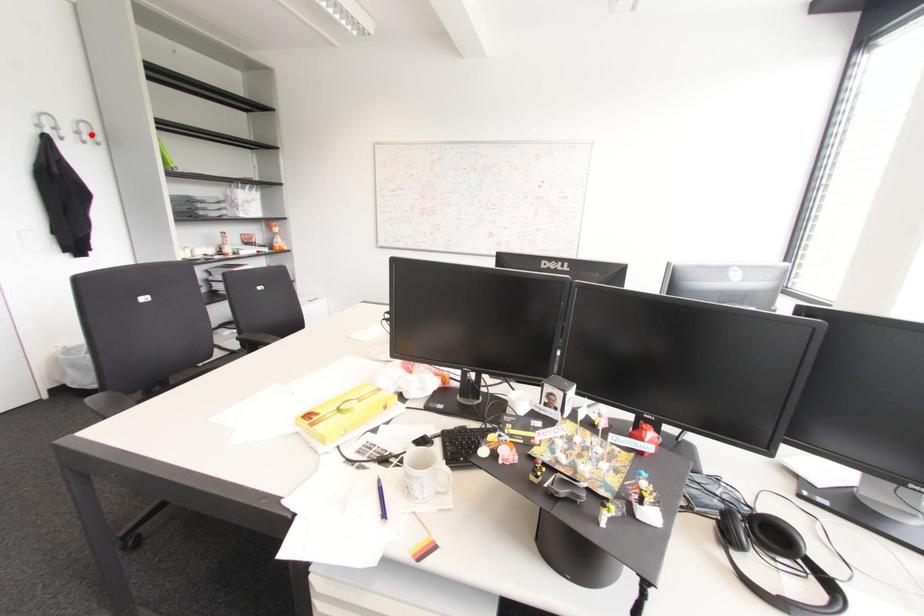
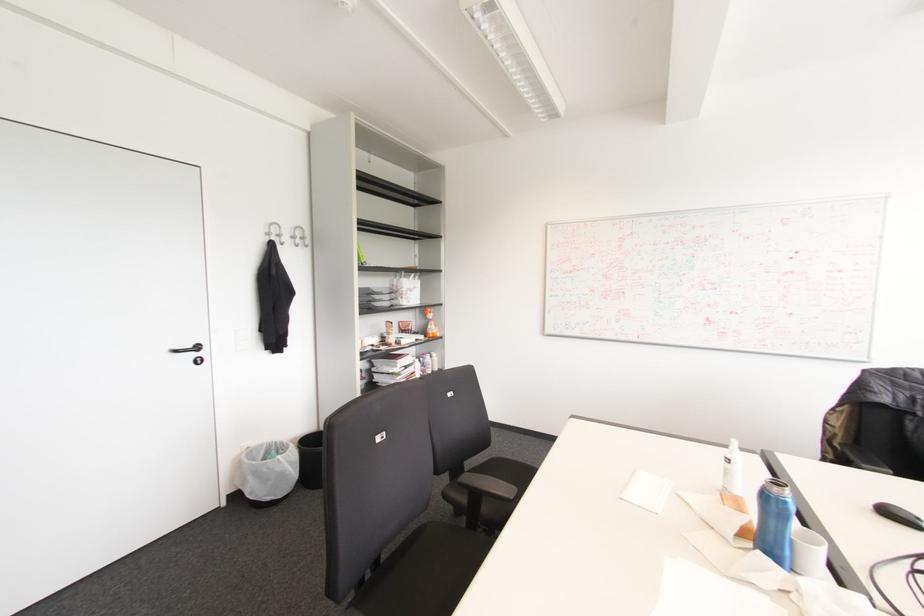
Locate, in the second image, the point that corresponds to the highlighted location in the first image.

(301, 238)